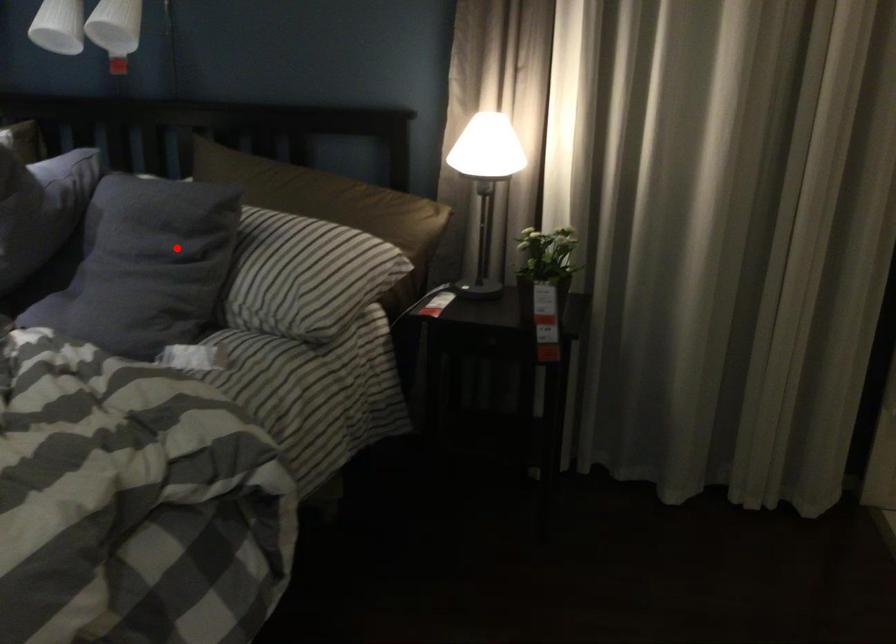
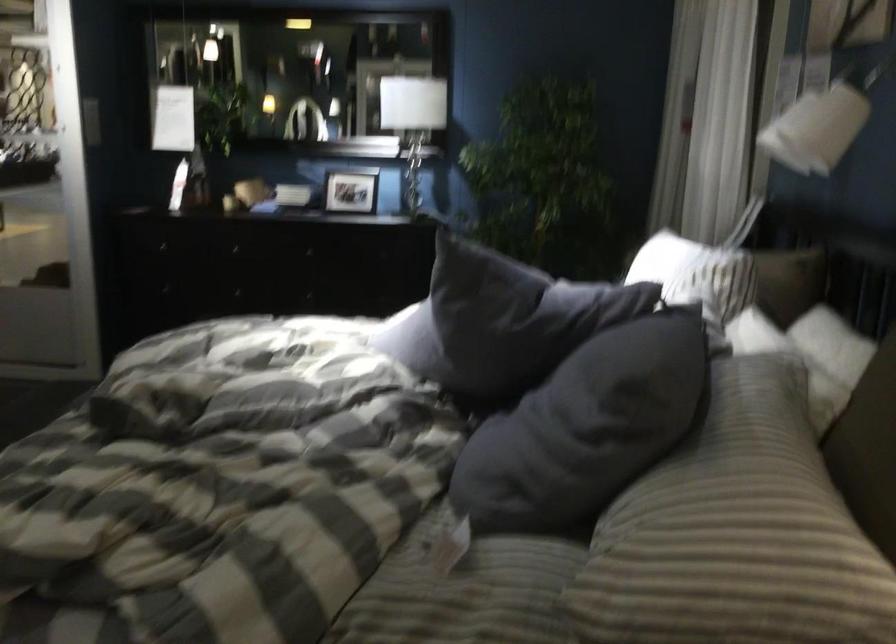
Question: I am providing you with two images of the same scene from different viewpoints. Image1 has a red point marked. In image2, the corresponding 3D location appears at what relative position? Reply with the corresponding letter.

Choices:
 (A) Closer
 (B) Farther

Answer: (A)